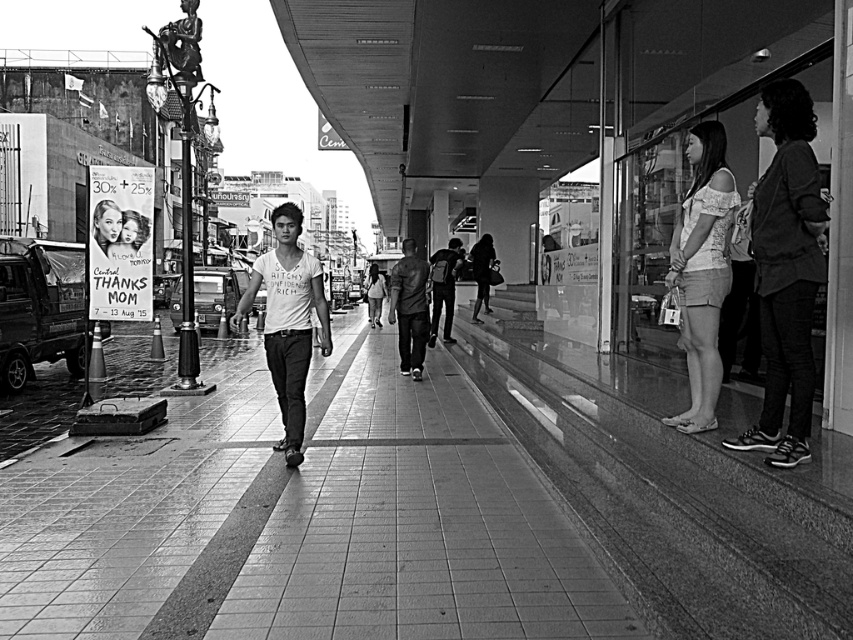
Based on the scene, can you determine which object is taller between the smooth concrete pavement at center and the white cotton shirt at center?

The white cotton shirt at center is taller than the smooth concrete pavement at center.

What is the 2D coordinate of the smooth concrete pavement at center in the image?

The smooth concrete pavement at center is located at the 2D coordinate point of (x=300, y=522).

Based on the scene, can you determine the spatial relationship between the white cotton shirt at center and the matte black bag at center?

The white cotton shirt at center is located below the matte black bag at center.